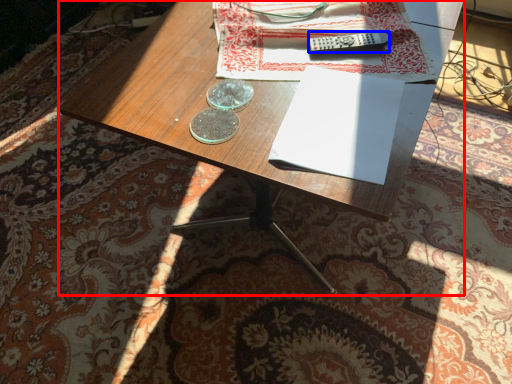
Question: Among these objects, which one is farthest to the camera, desk (highlighted by a red box) or remote control (highlighted by a blue box)?

Choices:
 (A) desk
 (B) remote control

Answer: (B)